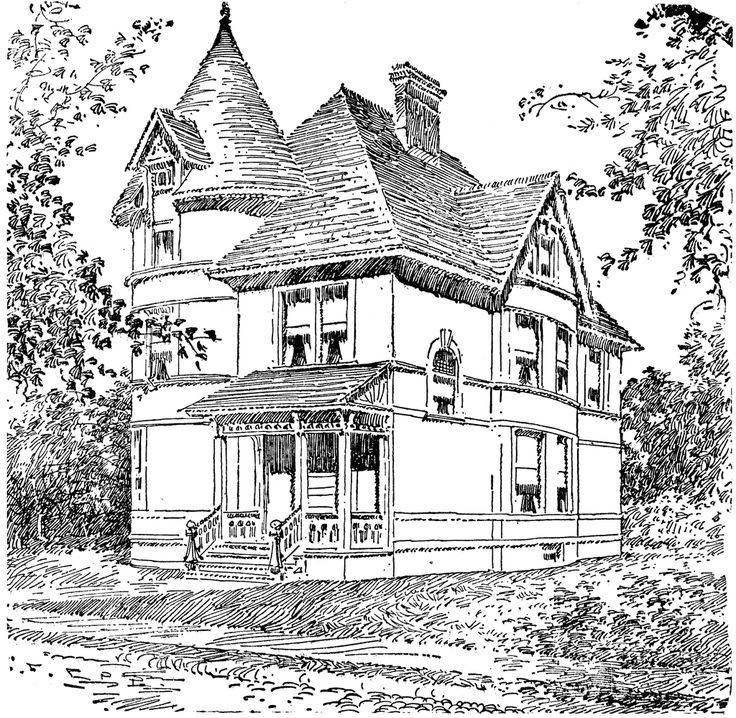
Locate an element on the screen. The width and height of the screenshot is (736, 718). chimney is located at coordinates (421, 120).